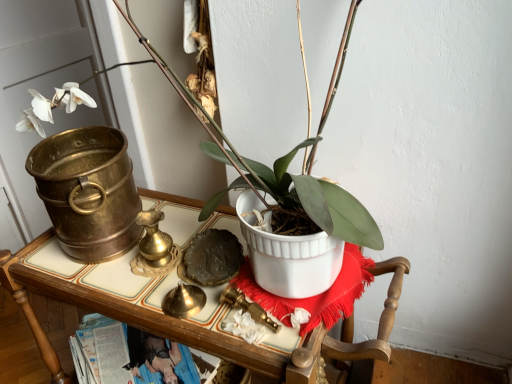
Question: Is white matte pot at center bigger or smaller than white ceramic pot at center?

Choices:
 (A) big
 (B) small

Answer: (B)

Question: Is white matte pot at center inside the boundaries of white ceramic pot at center, or outside?

Choices:
 (A) outside
 (B) inside

Answer: (A)

Question: From the image's perspective, relative to white ceramic pot at center, is white matte pot at center above or below?

Choices:
 (A) above
 (B) below

Answer: (A)

Question: Relative to white matte pot at center, is white ceramic pot at center in front or behind?

Choices:
 (A) behind
 (B) front

Answer: (A)

Question: Does point (389, 266) appear closer or farther from the camera than point (310, 283)?

Choices:
 (A) farther
 (B) closer

Answer: (A)

Question: From the image's perspective, is white ceramic pot at center positioned above or below white matte pot at center?

Choices:
 (A) above
 (B) below

Answer: (B)

Question: Is white ceramic pot at center spatially inside white matte pot at center, or outside of it?

Choices:
 (A) inside
 (B) outside

Answer: (B)